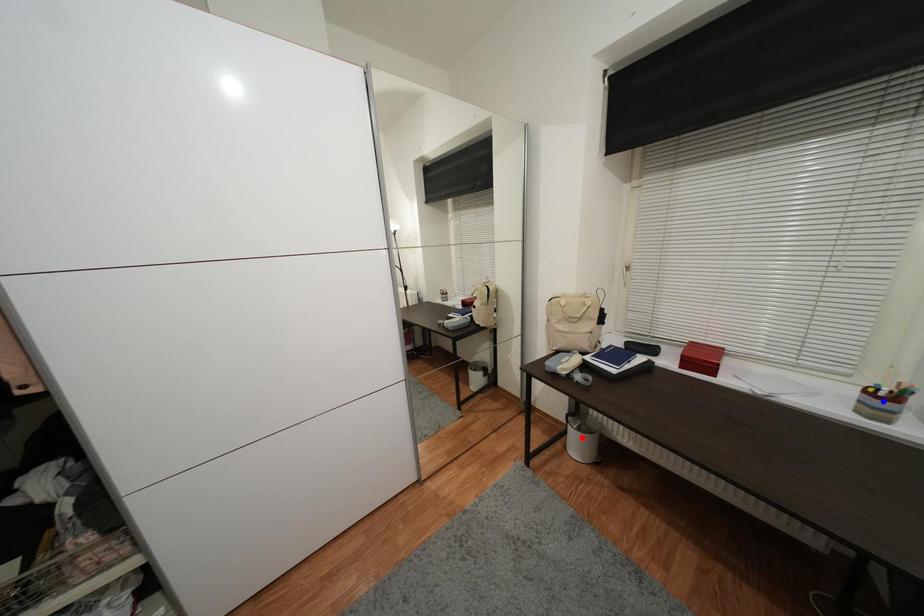
Question: In the image, two points are highlighted. Which point is nearer to the camera? Reply with the corresponding letter.

Choices:
 (A) blue point
 (B) red point

Answer: (A)